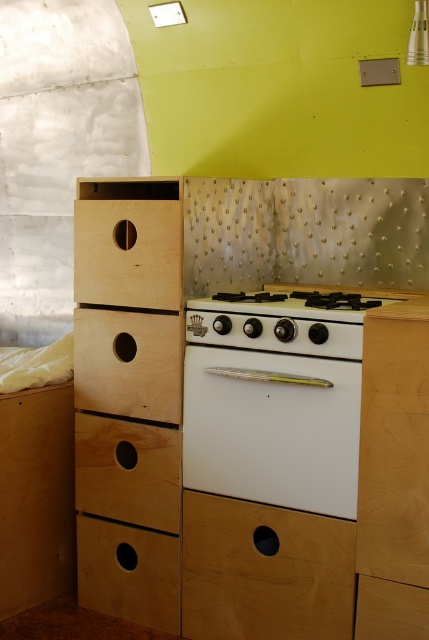
Which is in front, point (114, 465) or point (178, 563)?

Positioned in front is point (178, 563).

Locate an element on the screen. The width and height of the screenshot is (429, 640). light brown wood drawer at lower left is located at coordinates (127, 472).

Looking at this image, who is taller, bare wood drawer at left or light brown wood drawer at lower right?

bare wood drawer at left is taller.

Between bare wood drawer at left and light brown wood drawer at lower right, which one is positioned higher?

Positioned higher is bare wood drawer at left.

Between point (93, 282) and point (357, 609), which one is positioned in front?

Point (357, 609)

At what (x,y) coordinates should I click in order to perform the action: click on bare wood drawer at left. Please return your answer as a coordinate pair (x, y). Image resolution: width=429 pixels, height=640 pixels. Looking at the image, I should click on (127, 252).

Is point (393, 524) behind point (349, 577)?

No.

Consider the image. Is natural wood dresser at left shorter than light brown wood drawer at lower center?

In fact, natural wood dresser at left may be taller than light brown wood drawer at lower center.

Is point (126, 390) positioned behind point (184, 611)?

Yes, point (126, 390) is behind point (184, 611).

Locate an element on the screen. natural wood dresser at left is located at coordinates (247, 404).